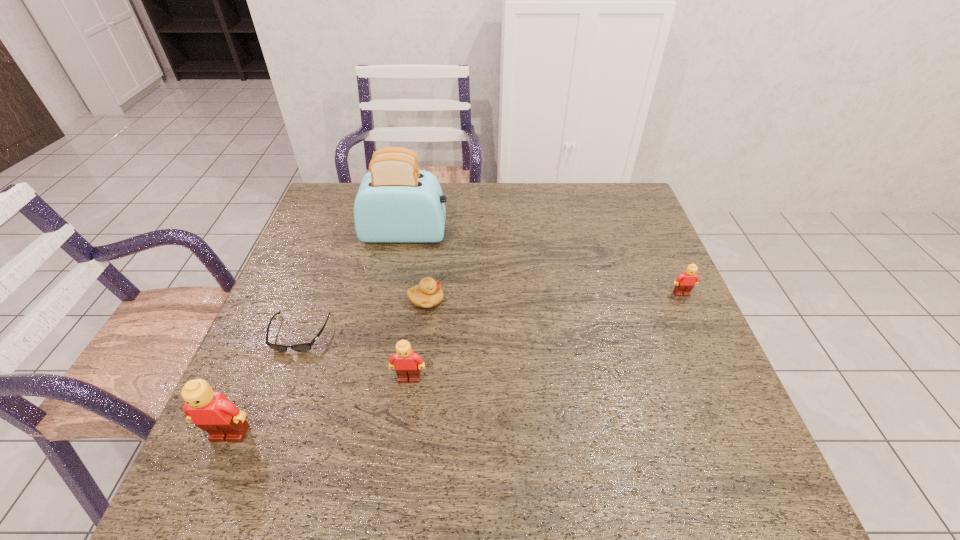
Locate an element on the screen. The image size is (960, 540). the tallest Lego is located at coordinates (213, 412).

This screenshot has height=540, width=960. In order to click on the leftmost Lego in this screenshot , I will do `click(213, 412)`.

Identify the location of the second nearest Lego. The image size is (960, 540). (407, 365).

Where is `the fifth farthest object`? The height and width of the screenshot is (540, 960). the fifth farthest object is located at coordinates (407, 365).

Identify the location of the farthest Lego. The image size is (960, 540). (685, 282).

Locate an element on the screen. The height and width of the screenshot is (540, 960). the third shortest object is located at coordinates (685, 282).

Image resolution: width=960 pixels, height=540 pixels. I want to click on the fifth tallest object, so click(x=428, y=294).

Identify the location of toaster. (396, 202).

Identify the location of the farthest object. This screenshot has width=960, height=540. (396, 202).

The image size is (960, 540). Find the location of `the shortest object`. the shortest object is located at coordinates (304, 347).